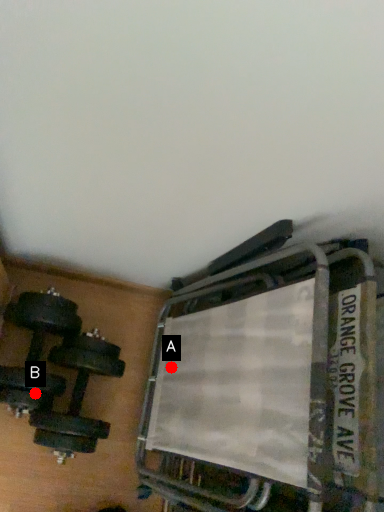
Question: Two points are circled on the image, labeled by A and B beside each circle. Among these points, which one is farthest from the camera?

Choices:
 (A) A is further
 (B) B is further

Answer: (A)